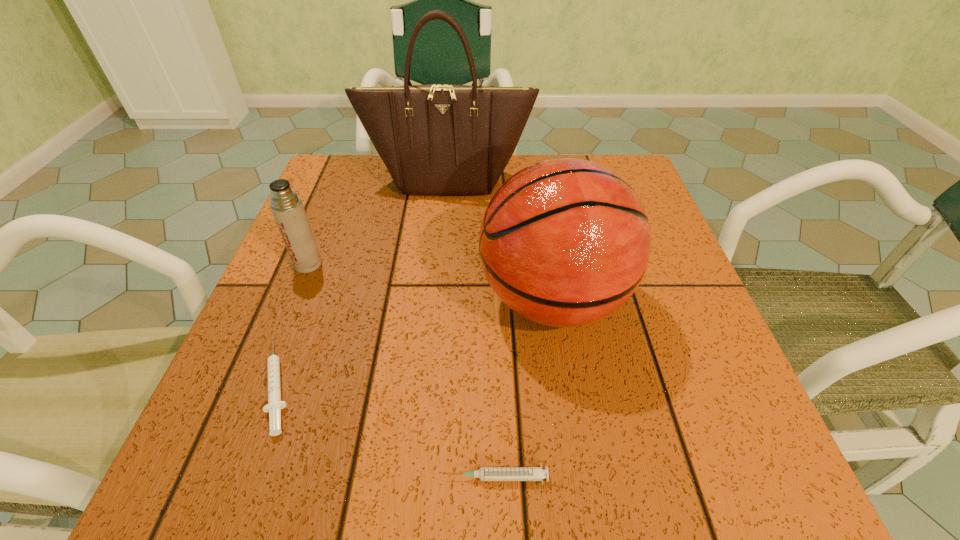
Where is `free point located on the side with spill of the basketball`? The image size is (960, 540). free point located on the side with spill of the basketball is located at coordinates (315, 300).

Where is `vacant space located 0.200m on the back of the thermos bottle`? The height and width of the screenshot is (540, 960). vacant space located 0.200m on the back of the thermos bottle is located at coordinates (335, 196).

Image resolution: width=960 pixels, height=540 pixels. Identify the location of free space located on the right of the left syringe. (480, 384).

Locate an element on the screen. The image size is (960, 540). vacant space located at the needle end of the nearest object is located at coordinates (337, 477).

At what (x,y) coordinates should I click in order to perform the action: click on vacant point located at the needle end of the nearest object. Please return your answer as a coordinate pair (x, y). Looking at the image, I should click on (259, 477).

Identify the location of vacant space located at the needle end of the nearest object. (392, 477).

The image size is (960, 540). What are the coordinates of `object at the far edge` in the screenshot? It's located at (436, 139).

In order to click on handbag situated at the left edge in this screenshot , I will do `click(436, 139)`.

Identify the location of thermos bottle present at the left edge. Image resolution: width=960 pixels, height=540 pixels. (287, 207).

Locate an element on the screen. syringe that is positioned at the left edge is located at coordinates (274, 406).